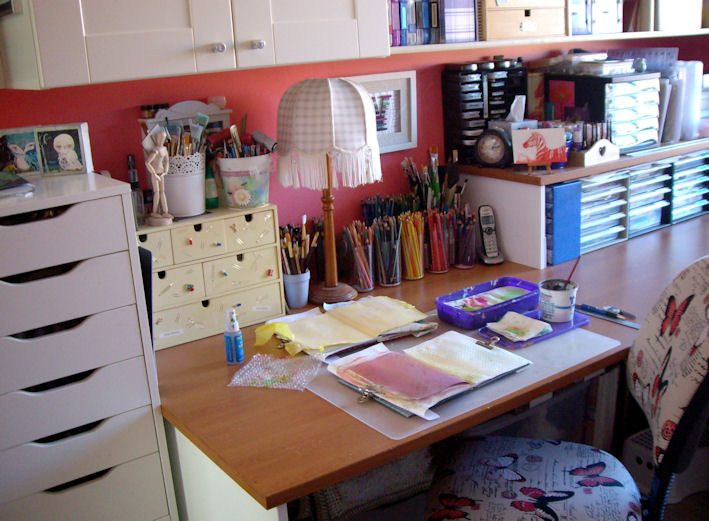
I want to click on desk, so click(x=313, y=421).